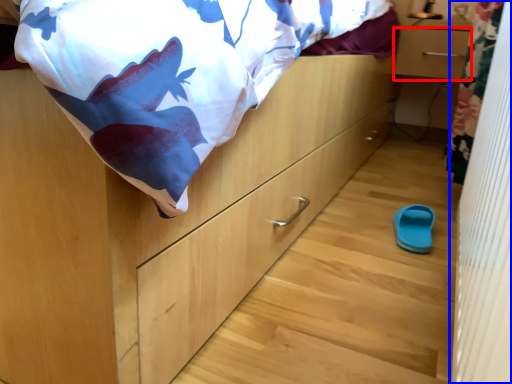
Question: Which point is further to the camera, drawer (highlighted by a red box) or curtain (highlighted by a blue box)?

Choices:
 (A) drawer
 (B) curtain

Answer: (A)